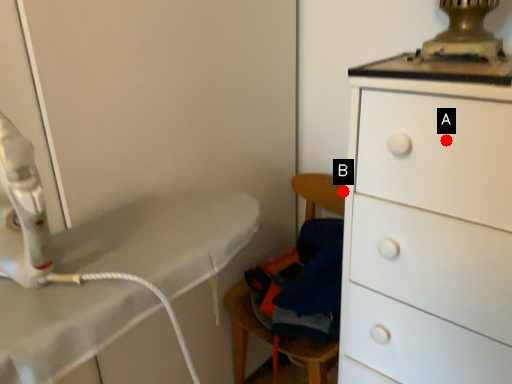
Question: Two points are circled on the image, labeled by A and B beside each circle. Which point is further to the camera?

Choices:
 (A) A is further
 (B) B is further

Answer: (B)